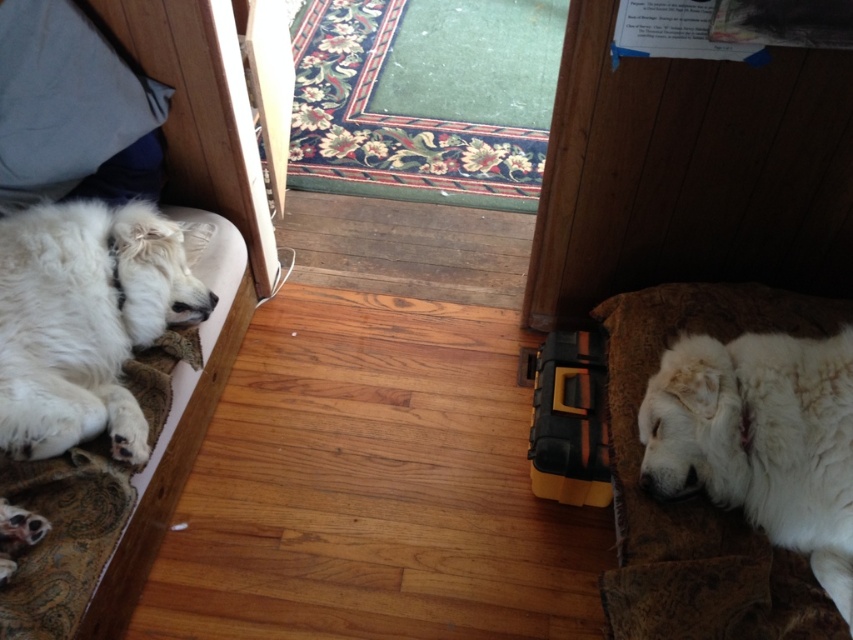
What do you see at coordinates (109, 460) in the screenshot?
I see `white soft bed at left` at bounding box center [109, 460].

Measure the distance from white soft bed at left to blue fabric pillow at upper left.

white soft bed at left is 5.96 inches from blue fabric pillow at upper left.

Identify the location of white soft bed at left. (109, 460).

Can you confirm if white fluffy dog at left is shorter than white fluffy dog at right?

Incorrect, white fluffy dog at left's height does not fall short of white fluffy dog at right's.

Between white fluffy dog at left and white fluffy dog at right, which one has less height?

white fluffy dog at right

Locate an element on the screen. The height and width of the screenshot is (640, 853). white fluffy dog at left is located at coordinates (85, 321).

Locate an element on the screen. white fluffy dog at left is located at coordinates (85, 321).

Is white soft bed at left further to camera compared to white fluffy dog at right?

Yes.

Between point (200, 92) and point (733, 508), which one is positioned in front?

Point (733, 508)

The width and height of the screenshot is (853, 640). In order to click on white soft bed at left in this screenshot , I will do `click(109, 460)`.

Identify the location of white soft bed at left. 109,460.